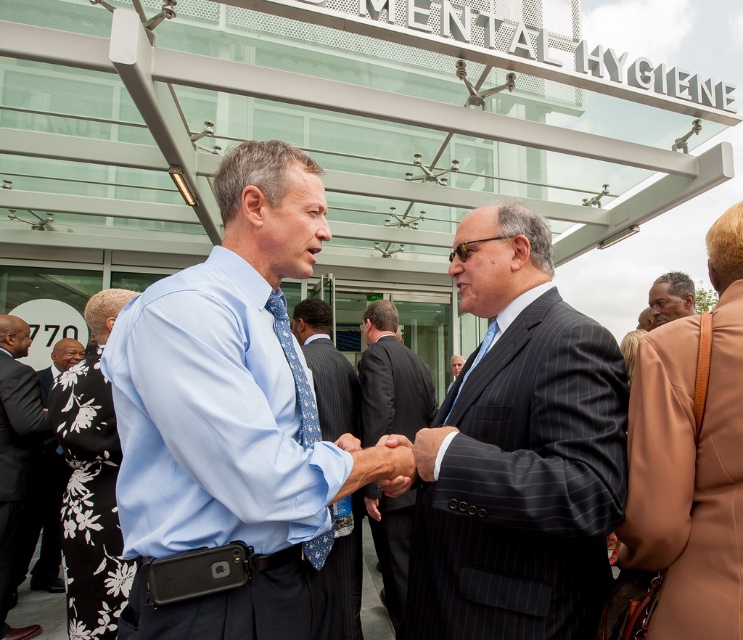
You are standing 5 feet away from the entrance of the building. A point at coordinates point [275,416] is part of the scene. Can you determine if this point is closer to you than the entrance?

The distance of point [275,416] from viewer is 4.72 feet, which is less than 5 feet, so the point is closer to you than the entrance.